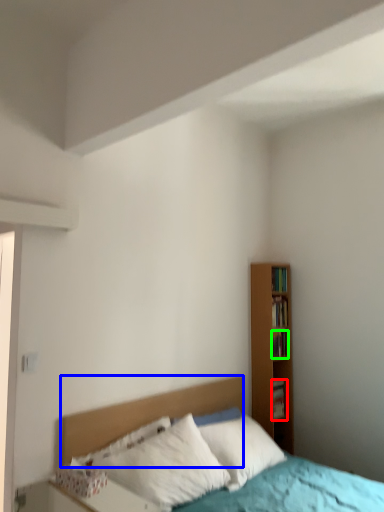
Question: Estimate the real-world distances between objects in this image. Which object is farther from book (highlighted by a red box), headboard (highlighted by a blue box) or book (highlighted by a green box)?

Choices:
 (A) headboard
 (B) book

Answer: (A)